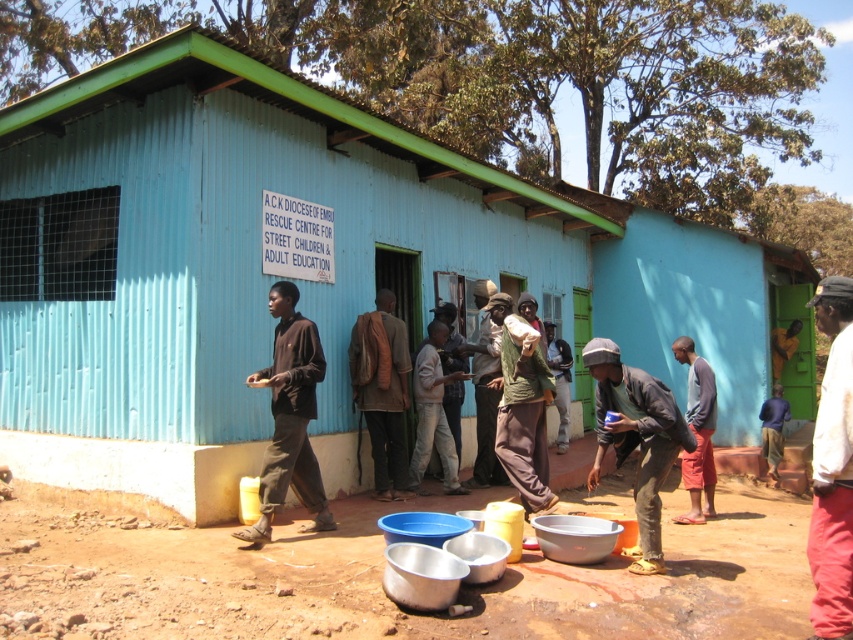
Identify the location of dark gray fabric jacket at lower right. (636, 438).

Is dark gray fabric jacket at lower right taller than blue cotton shirt at center?

No, dark gray fabric jacket at lower right is not taller than blue cotton shirt at center.

Who is more forward, (686, 426) or (683, 476)?

Point (686, 426) is more forward.

Identify the location of dark gray fabric jacket at lower right. (636, 438).

Between white cotton shirt at right and dark brown leather jacket at center, which one is positioned lower?

Positioned lower is white cotton shirt at right.

Which is more to the left, white cotton shirt at right or dark brown leather jacket at center?

dark brown leather jacket at center

Does point (824, 296) come behind point (431, 308)?

That is False.

Locate an element on the screen. This screenshot has width=853, height=640. white cotton shirt at right is located at coordinates (833, 467).

Does brown dirt field at lower center appear on the left side of dark gray fabric jacket at lower right?

Correct, you'll find brown dirt field at lower center to the left of dark gray fabric jacket at lower right.

Which of these two, brown dirt field at lower center or dark gray fabric jacket at lower right, stands taller?

With more height is dark gray fabric jacket at lower right.

Is point (77, 596) farther from camera compared to point (656, 541)?

No.

This screenshot has height=640, width=853. I want to click on brown dirt field at lower center, so click(x=381, y=573).